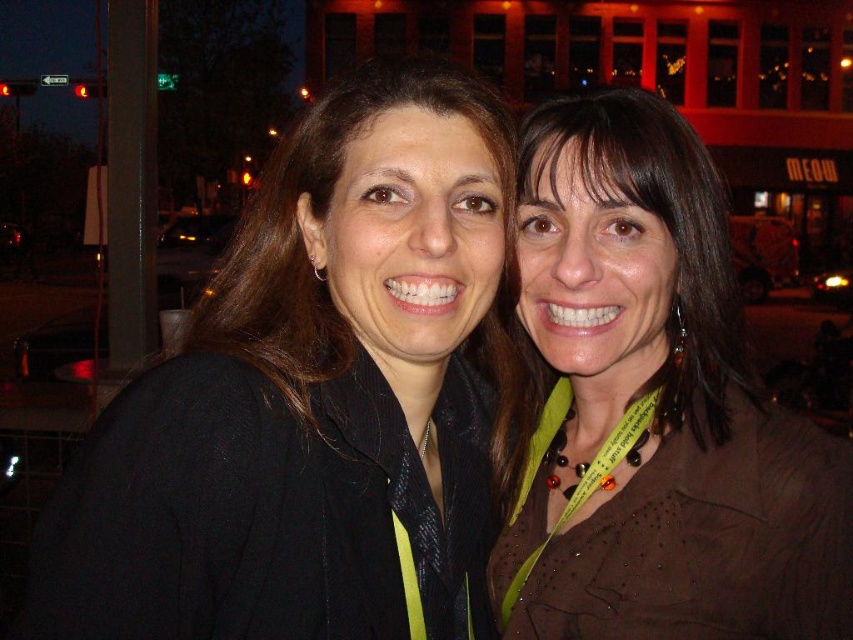
You are a photographer trying to locate the brown matte shirt at center in the image. Based on the coordinates provided, can you determine its position relative to the center of the image?

The brown matte shirt at center is located at coordinates point (654, 406), which is slightly to the right and below the center of the image.

You are a photographer trying to capture a photo of the two women in the scene. You need to ensure that the brown matte shirt at center and the brown matte hair at right are both in focus. Based on their positions, which object should you focus on first to ensure both are sharp?

The brown matte shirt at center is to the left of brown matte hair at right, so focusing on the brown matte shirt at center first will help ensure both are in focus since it is closer to the camera.

You are a delivery robot with a width of 0.8 meters. You need to move between the two women standing at point (x=746, y=460). Can you fit through the space between them?

The two women are 1.12 meters apart, so the delivery robot with a width of 0.8 meters can fit through the space between them since 0.8 meters is less than 1.12 meters.